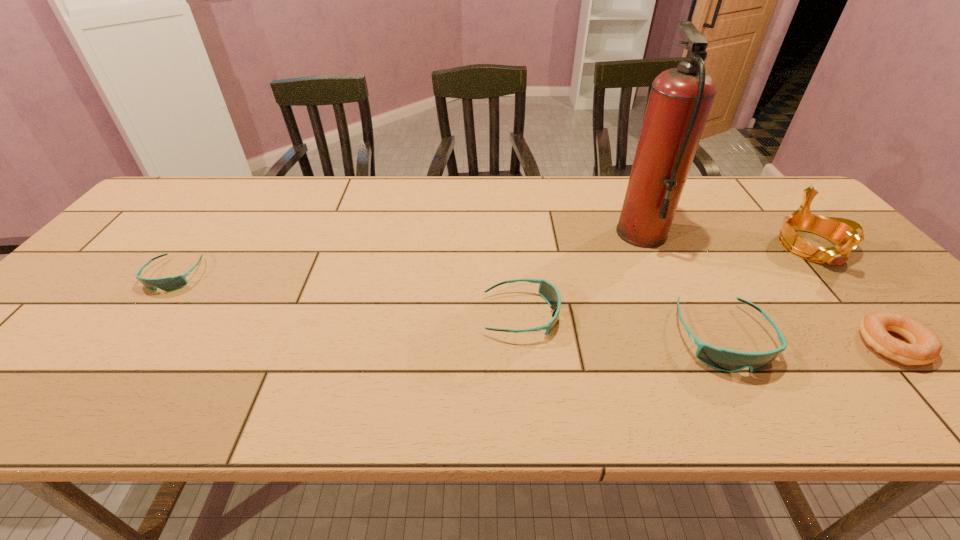
This screenshot has width=960, height=540. Identify the location of free space for an extra sunglasses to achieve even spacing. (340, 294).